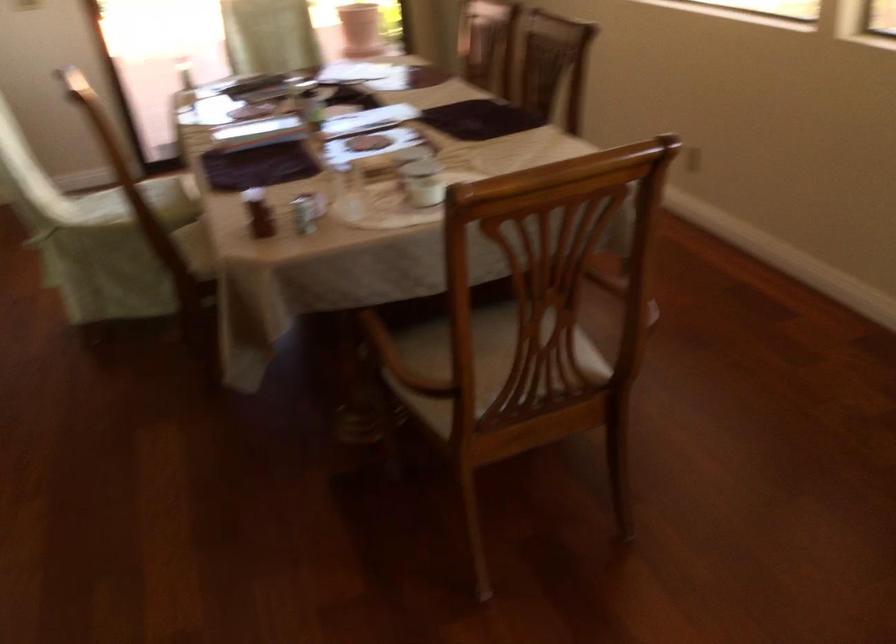
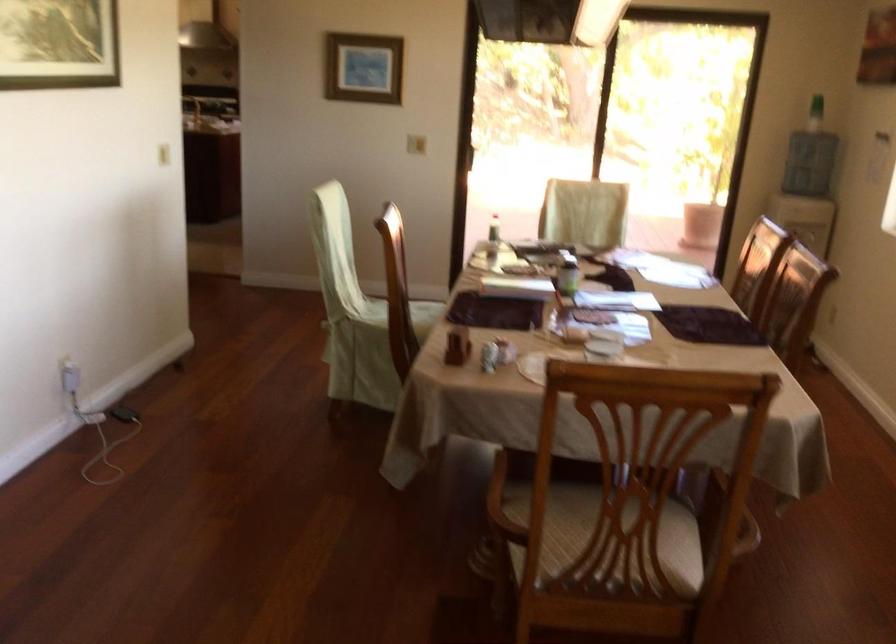
Locate, in the second image, the point that corresponds to the point at 299,105 in the first image.

(566, 272)